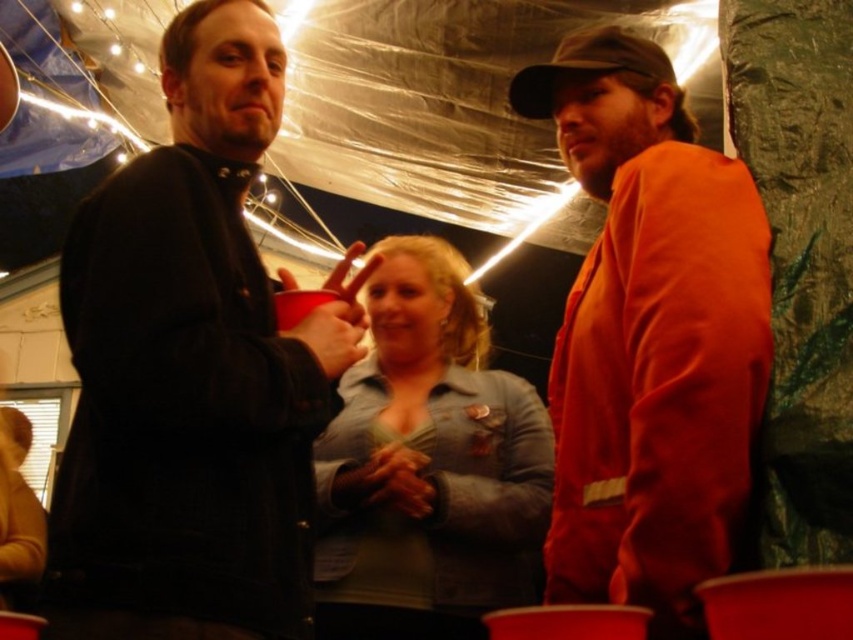
Question: Can you confirm if matte black jacket at left is positioned above orange cotton shirt at right?

Choices:
 (A) yes
 (B) no

Answer: (A)

Question: Which object is positioned closest to the matte black jacket at left?

Choices:
 (A) orange cotton shirt at right
 (B) denim jacket at center

Answer: (B)

Question: Is orange cotton shirt at right to the right of denim jacket at center from the viewer's perspective?

Choices:
 (A) no
 (B) yes

Answer: (B)

Question: Which point is closer to the camera?

Choices:
 (A) matte black jacket at left
 (B) orange cotton shirt at right

Answer: (B)

Question: Is orange cotton shirt at right wider than denim jacket at center?

Choices:
 (A) no
 (B) yes

Answer: (A)

Question: Which point is closer to the camera?

Choices:
 (A) orange cotton shirt at right
 (B) matte black jacket at left

Answer: (A)